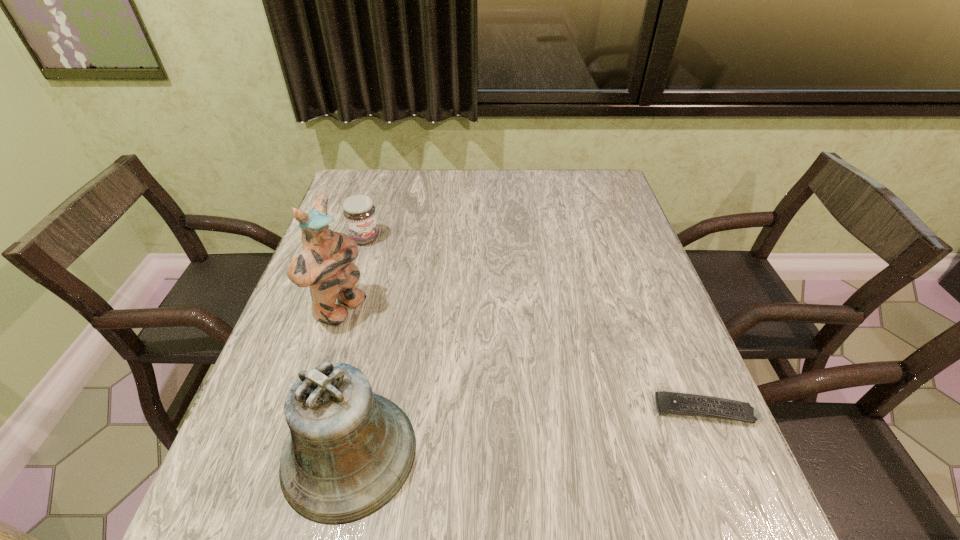
What are the coordinates of `vacant space on the desktop that is between the second tallest object and the rightmost object and is positioned on the front label of the second shortest object` in the screenshot? It's located at (529, 431).

Locate an element on the screen. vacant space on the desktop that is between the bell and the shortest object and is positioned on the front-facing side of the tallest object is located at coordinates (560, 428).